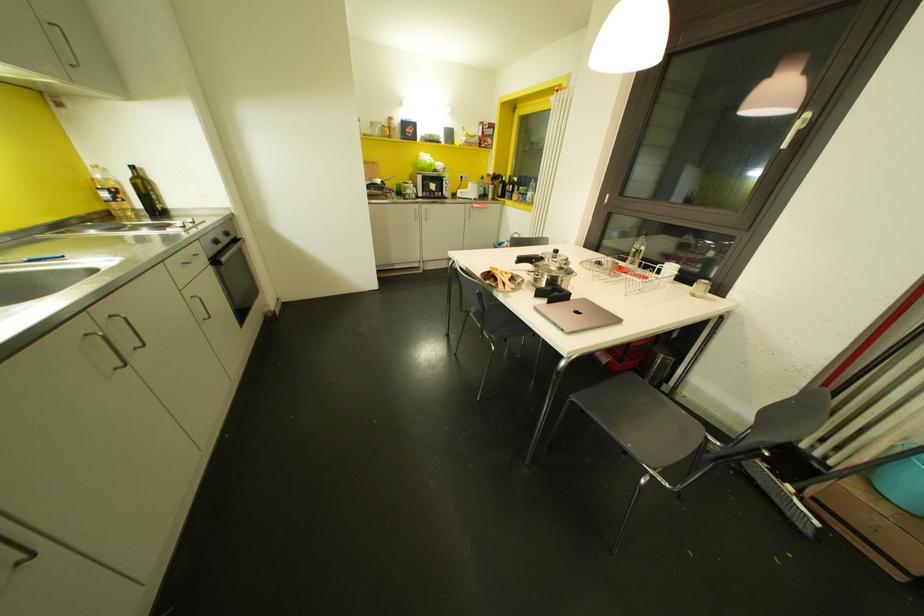
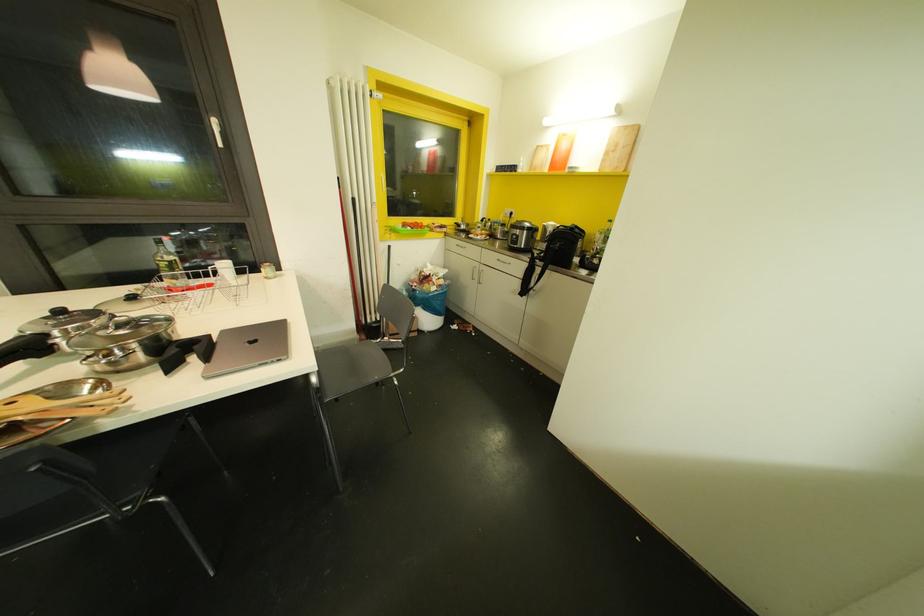
Where in the second image is the point corresponding to the point at 637,249 from the first image?

(169, 262)